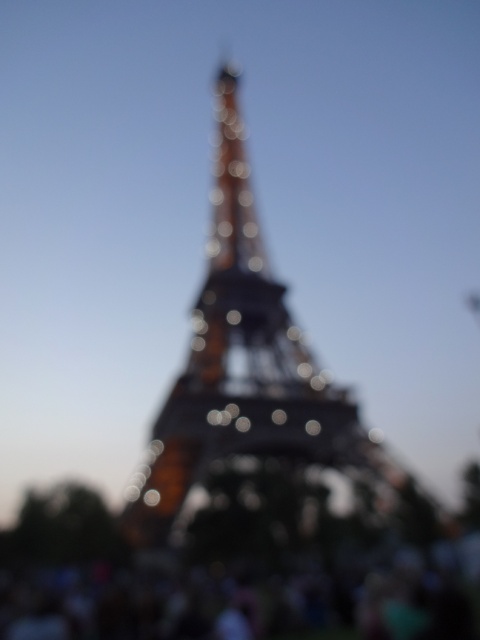
Is point (248, 316) in front of point (180, 588)?

No.

Does metallic structure at center come behind blurred crowd at lower center?

That is False.

What do you see at coordinates (261, 412) in the screenshot? This screenshot has width=480, height=640. I see `metallic structure at center` at bounding box center [261, 412].

You are a GUI agent. You are given a task and a screenshot of the screen. Output one action in this format:
    pyautogui.click(x=<x>, y=<y>)
    Task: Click on the metallic structure at center
    
    Given the screenshot: What is the action you would take?
    pyautogui.click(x=261, y=412)